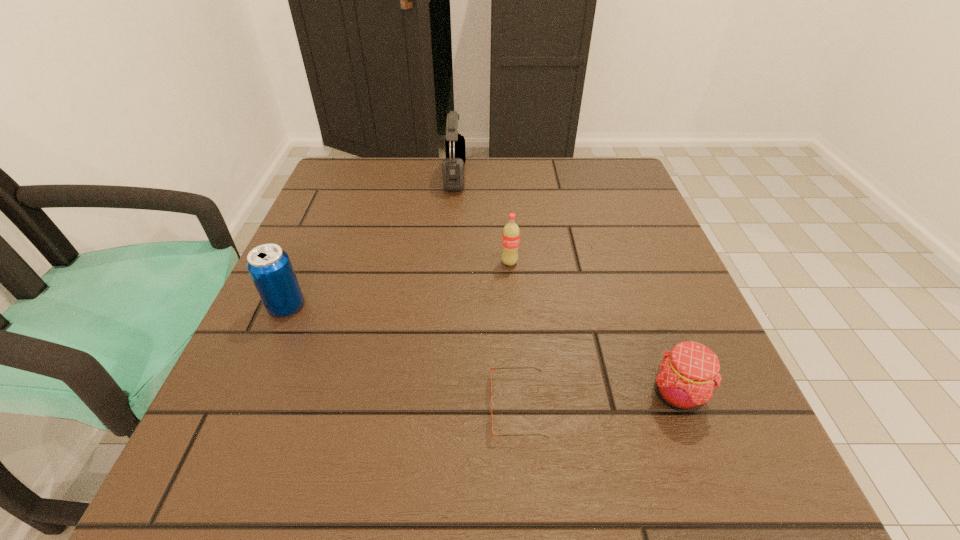
Identify the location of blank area in the image that satisfies the following two spatial constraints: 1. on the headband of the fourth object from right to left; 2. on the left side of the rightmost object. The image size is (960, 540). (438, 394).

You are a GUI agent. You are given a task and a screenshot of the screen. Output one action in this format:
    pyautogui.click(x=<x>, y=<y>)
    Task: Click on the free space that satisfies the following two spatial constraints: 1. on the headband of the right soda; 2. on the right side of the farthest object
    
    Given the screenshot: What is the action you would take?
    pyautogui.click(x=448, y=262)

Identify the location of free location that satisfies the following two spatial constraints: 1. on the headband of the headset; 2. on the front side of the leftmost object. This screenshot has height=540, width=960. (444, 306).

This screenshot has height=540, width=960. I want to click on vacant space that satisfies the following two spatial constraints: 1. on the headband of the fourth nearest object; 2. on the left side of the tallest object, so click(448, 262).